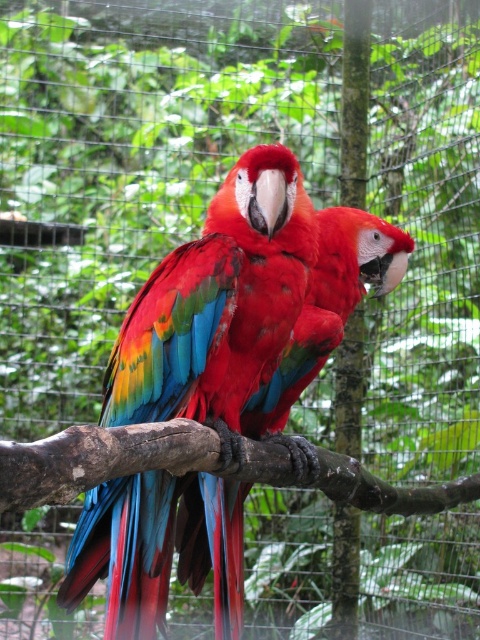
Is point (226, 433) farther from viewer compared to point (173, 428)?

That is True.

Is point (218, 294) less distant than point (168, 445)?

No.

Does point (216, 220) come behind point (134, 454)?

Yes, it is behind point (134, 454).

Find the location of a particular element. The height and width of the screenshot is (640, 480). glossy feathers parrot at center is located at coordinates (218, 305).